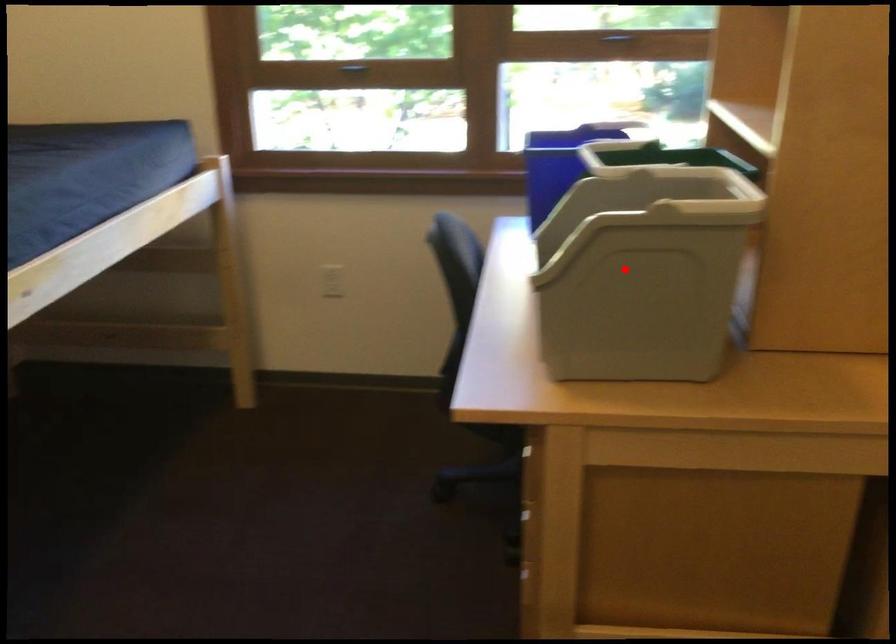
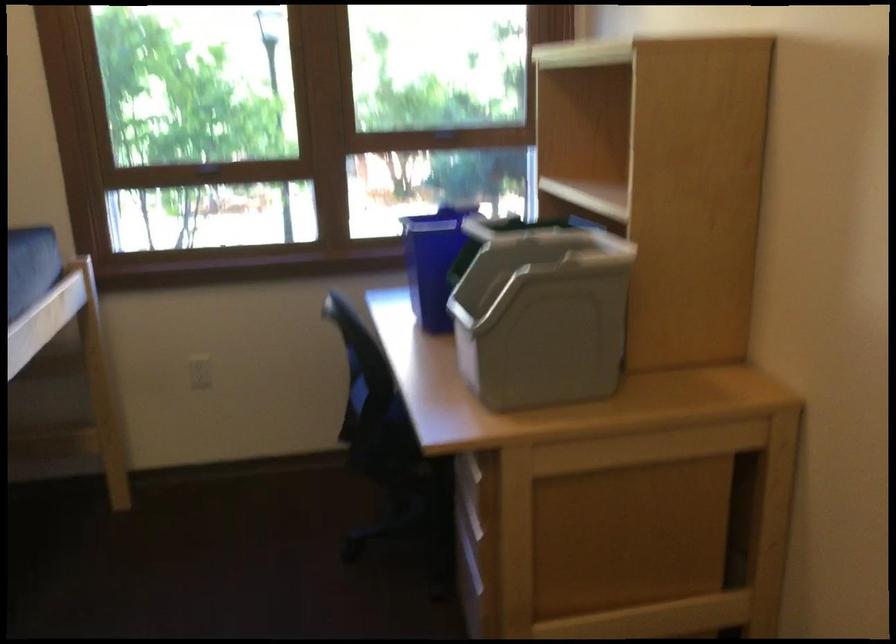
Find the pixel in the second image that matches the highlighted location in the first image.

(540, 313)